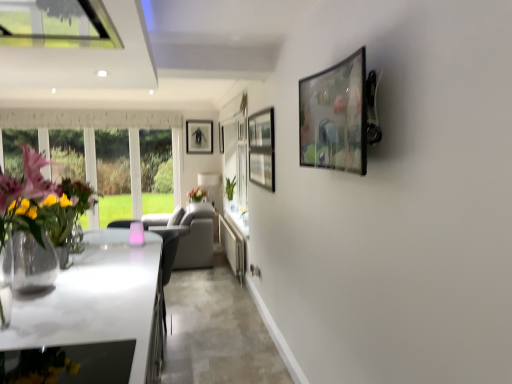
Where is `metallic glossy picture frame at upper right, arranged as the 1th picture frame when viewed from the right`? This screenshot has width=512, height=384. metallic glossy picture frame at upper right, arranged as the 1th picture frame when viewed from the right is located at coordinates (335, 117).

What do you see at coordinates (199, 136) in the screenshot? I see `matte black picture frame at center, placed as the 3th picture frame when sorted from right to left` at bounding box center [199, 136].

What is the approximate width of white fabric lampshade at center?

The width of white fabric lampshade at center is 16.13 inches.

You are a GUI agent. You are given a task and a screenshot of the screen. Output one action in this format:
    pyautogui.click(x=<x>, y=<y>)
    Task: Click on the clear glass vase at left
    Image resolution: width=512 pixels, height=384 pixels.
    Given the screenshot: What is the action you would take?
    pyautogui.click(x=38, y=218)

At what (x,y) coordinates should I click in order to perform the action: click on black matte picture frame at center, the 2th picture frame viewed from the back. Please return your answer as a coordinate pair (x, y). This screenshot has width=512, height=384. Looking at the image, I should click on (221, 138).

Is matte black picture frame at center, placed as the 3th picture frame when sorted from right to left, surrounded by clear glass vase at left?

That's incorrect, matte black picture frame at center, placed as the 3th picture frame when sorted from right to left, is not inside clear glass vase at left.

Does clear glass vase at left come in front of matte black picture frame at center, which is the first picture frame in back-to-front order?

Yes, clear glass vase at left is closer to the viewer.

Which object is positioned more to the right, clear glass vase at left or matte black picture frame at center, the first picture frame from the left?

clear glass vase at left is more to the right.

From a real-world perspective, is clear glass vase at left above or below matte black picture frame at center, placed as the 3th picture frame when sorted from right to left?

In terms of real-world spatial position, clear glass vase at left is below matte black picture frame at center, placed as the 3th picture frame when sorted from right to left.

In the scene shown: Are black matte picture frame at center, acting as the second picture frame starting from the right, and translucent glass vase at center far apart?

That's not correct — black matte picture frame at center, acting as the second picture frame starting from the right, is a little close to translucent glass vase at center.

Looking at this image, from the image's perspective, is black matte picture frame at center, acting as the 2th picture frame starting from the front, positioned above or below translucent glass vase at center?

black matte picture frame at center, acting as the 2th picture frame starting from the front, is above translucent glass vase at center.

In terms of size, does black matte picture frame at center, acting as the 2th picture frame starting from the front, appear bigger or smaller than translucent glass vase at center?

Considering their sizes, black matte picture frame at center, acting as the 2th picture frame starting from the front, takes up less space than translucent glass vase at center.

Is point (222, 150) positioned behind point (189, 195)?

That is True.

Considering the sizes of objects white glossy counter top at center and white glossy countertop at lower left in the image provided, who is smaller, white glossy counter top at center or white glossy countertop at lower left?

white glossy counter top at center is smaller.

Considering the positions of objects white glossy counter top at center and white glossy countertop at lower left in the image provided, who is more to the left, white glossy counter top at center or white glossy countertop at lower left?

Positioned to the left is white glossy countertop at lower left.

Would you say white glossy countertop at lower left is part of white glossy counter top at center's contents?

No.

Considering the relative sizes of black matte picture frame at center, the 2th picture frame viewed from the back, and metallic glossy picture frame at upper right, arranged as the 1th picture frame when viewed from the right, in the image provided, is black matte picture frame at center, the 2th picture frame viewed from the back, smaller than metallic glossy picture frame at upper right, arranged as the 1th picture frame when viewed from the right,?

Yes, black matte picture frame at center, the 2th picture frame viewed from the back, is smaller than metallic glossy picture frame at upper right, arranged as the 1th picture frame when viewed from the right.

Is black matte picture frame at center, marked as the second picture frame in a left-to-right arrangement, positioned with its back to metallic glossy picture frame at upper right, the third picture frame viewed from the left?

No.

What's the angular difference between black matte picture frame at center, acting as the second picture frame starting from the right, and metallic glossy picture frame at upper right, the third picture frame viewed from the left,'s facing directions?

The facing directions of black matte picture frame at center, acting as the second picture frame starting from the right, and metallic glossy picture frame at upper right, the third picture frame viewed from the left, are 0.906 degrees apart.

Can you confirm if black matte picture frame at center, acting as the 2th picture frame starting from the front, is shorter than metallic glossy picture frame at upper right, the third picture frame viewed from the left?

No, black matte picture frame at center, acting as the 2th picture frame starting from the front, is not shorter than metallic glossy picture frame at upper right, the third picture frame viewed from the left.

Is metallic glossy picture frame at upper right, arranged as the 1th picture frame when viewed from the right, placed right next to white fabric lampshade at center?

They are not placed beside each other.

Is metallic glossy picture frame at upper right, the first picture frame positioned from the front, further to the viewer compared to white fabric lampshade at center?

No.

Is metallic glossy picture frame at upper right, the first picture frame positioned from the front, oriented away from white fabric lampshade at center?

No, metallic glossy picture frame at upper right, the first picture frame positioned from the front, is not facing the opposite direction of white fabric lampshade at center.

Is white glossy counter top at center not within translucent glass vase at center?

Yes.

From a real-world perspective, between white glossy counter top at center and translucent glass vase at center, who is vertically higher?

translucent glass vase at center.

From the image's perspective, is white glossy counter top at center beneath translucent glass vase at center?

Yes.

Which is correct: matte black picture frame at center, the first picture frame from the left, is inside white glossy counter top at center, or outside of it?

matte black picture frame at center, the first picture frame from the left, is located beyond the bounds of white glossy counter top at center.

From a real-world perspective, which is physically below, matte black picture frame at center, placed as the 3th picture frame when sorted from right to left, or white glossy counter top at center?

From a 3D spatial view, white glossy counter top at center is below.

Between matte black picture frame at center, which is the first picture frame in back-to-front order, and white glossy counter top at center, which one has smaller width?

matte black picture frame at center, which is the first picture frame in back-to-front order.

Can you tell me how much matte black picture frame at center, placed as the 3th picture frame when sorted from right to left, and white glossy counter top at center differ in facing direction?

They differ by 91.6 degrees in their facing directions.

Identify the location of the 3rd picture frame directly above the clear glass vase at left (from a real-world perspective). (199, 136).

The width and height of the screenshot is (512, 384). I want to click on flower in front of the black matte picture frame at center, the 2th picture frame viewed from the back, so click(x=197, y=193).

When comparing their distances from black matte picture frame at center, marked as the second picture frame in a left-to-right arrangement, does white glossy countertop at lower left or metallic glossy picture frame at upper right, the third picture frame viewed from the left, seem further?

metallic glossy picture frame at upper right, the third picture frame viewed from the left, is positioned further to the anchor black matte picture frame at center, marked as the second picture frame in a left-to-right arrangement.

From the image, which object appears to be nearer to white glossy countertop at lower left, white glossy counter top at center or translucent glass vase at center?

white glossy counter top at center lies closer to white glossy countertop at lower left than the other object.

In the scene shown: Based on their spatial positions, is metallic glossy picture frame at upper right, which is counted as the third picture frame, starting from the back, or white glossy countertop at lower left further from white glossy counter top at center?

Among the two, metallic glossy picture frame at upper right, which is counted as the third picture frame, starting from the back, is located further to white glossy counter top at center.

Looking at the image, which one is located closer to metallic glossy picture frame at upper right, arranged as the 1th picture frame when viewed from the right, white glossy countertop at lower left or clear glass vase at left?

Among the two, white glossy countertop at lower left is located nearer to metallic glossy picture frame at upper right, arranged as the 1th picture frame when viewed from the right.

From the image, which object appears to be nearer to matte black picture frame at center, which appears as the third picture frame when viewed from the front, metallic glossy picture frame at upper right, arranged as the 1th picture frame when viewed from the right, or white glossy counter top at center?

white glossy counter top at center.

Which object lies nearer to the anchor point white glossy counter top at center, white fabric lampshade at center or clear glass vase at left?

white fabric lampshade at center is closer to white glossy counter top at center.

Considering their positions, is translucent glass vase at center positioned closer to white glossy countertop at lower left than matte black picture frame at center, placed as the 3th picture frame when sorted from right to left?

translucent glass vase at center is positioned closer to the anchor white glossy countertop at lower left.

Considering their positions, is black matte picture frame at center, acting as the 2th picture frame starting from the front, positioned further to clear glass vase at left than metallic glossy picture frame at upper right, the third picture frame viewed from the left?

The object further to clear glass vase at left is black matte picture frame at center, acting as the 2th picture frame starting from the front.

Image resolution: width=512 pixels, height=384 pixels. I want to click on flower between metallic glossy picture frame at upper right, the first picture frame positioned from the front, and white fabric lampshade at center in the front-back direction, so click(197, 193).

At what (x,y) coordinates should I click in order to perform the action: click on lamp between white glossy counter top at center and matte black picture frame at center, the first picture frame from the left, along the z-axis. Please return your answer as a coordinate pair (x, y). This screenshot has width=512, height=384. Looking at the image, I should click on (210, 184).

Where is `counter top located between metallic glossy picture frame at upper right, the third picture frame viewed from the left, and black matte picture frame at center, marked as the second picture frame in a left-to-right arrangement, in the depth direction`? This screenshot has height=384, width=512. counter top located between metallic glossy picture frame at upper right, the third picture frame viewed from the left, and black matte picture frame at center, marked as the second picture frame in a left-to-right arrangement, in the depth direction is located at coordinates (233, 246).

This screenshot has width=512, height=384. Identify the location of counter top positioned between white glossy countertop at lower left and translucent glass vase at center from near to far. (233, 246).